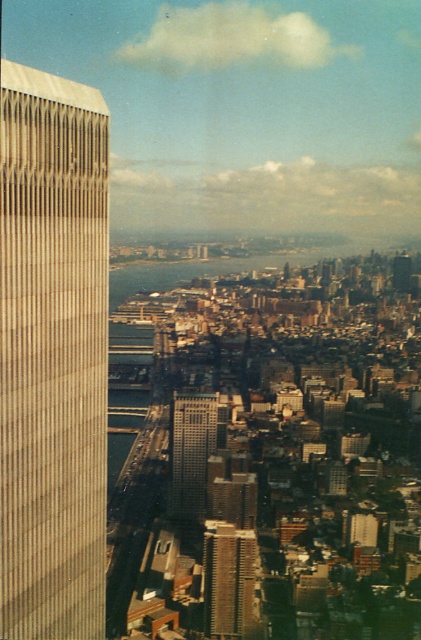
You are a drone operator tasked with delivering a package from the beige textured building at left to a location across the city. The shortest distance between the two points is 587.74 meters. Can you confirm if this distance is within your drone model X7000, which has a maximum range of 600 meters?

The shortest distance between the beige textured building at left and the destination is 587.74 meters, which is within the drone model X7000 maximum range of 600 meters. The delivery is possible.

You are standing on a rooftop in the city and see the beige textured building at left and the silver glass skyscraper at center. Which building is positioned further to the east?

The beige textured building at left is positioned to the left of the silver glass skyscraper at center, so it is further to the east.

You are standing on a rooftop overlooking the city and see the beige textured building at left and the gray concrete building at center. Which building appears closer to you based on their positions in the scene?

The beige textured building at left appears closer because it is positioned over the gray concrete building at center, indicating it is in front.